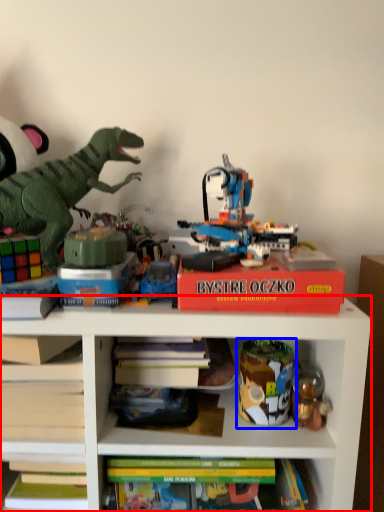
Question: Which object is closer to the camera taking this photo, shelf (highlighted by a red box) or toy (highlighted by a blue box)?

Choices:
 (A) shelf
 (B) toy

Answer: (A)